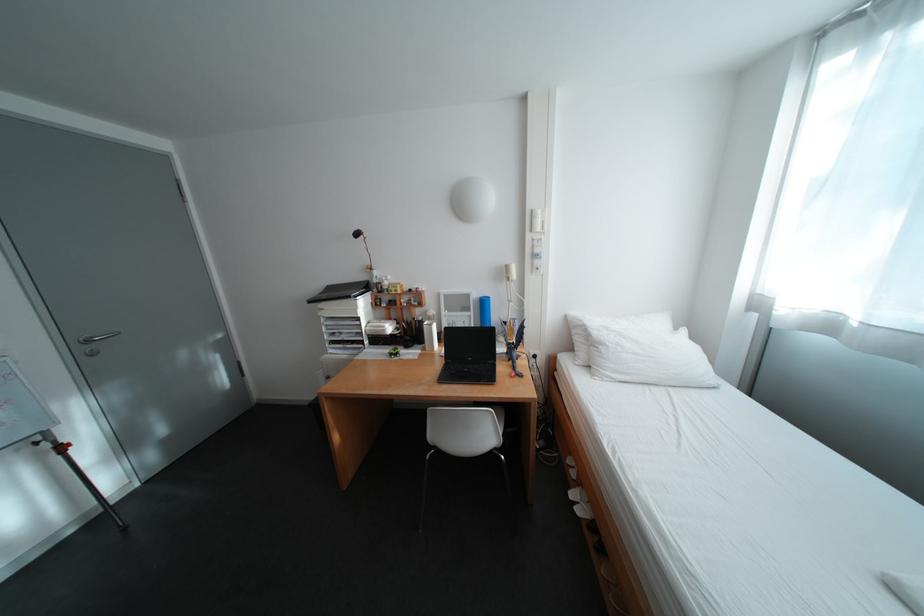
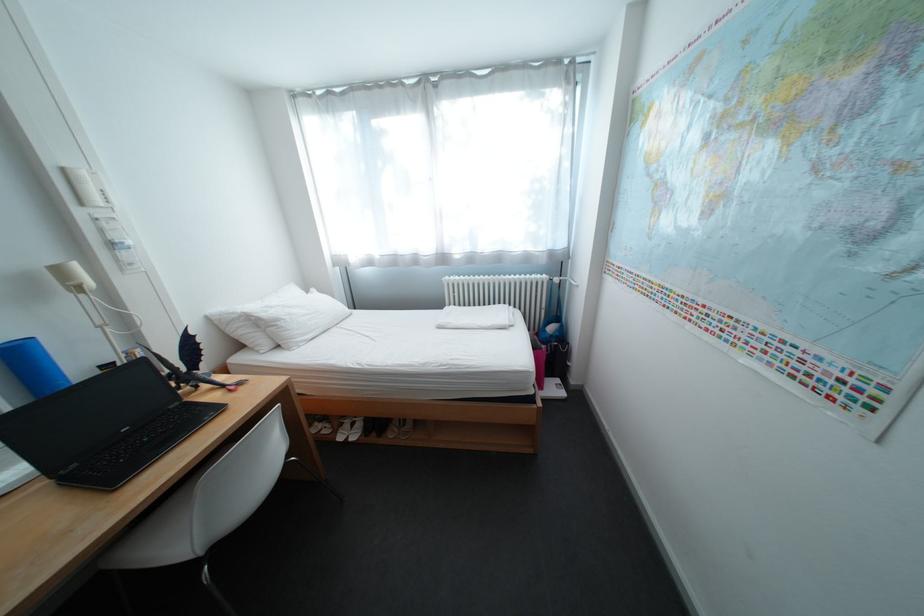
In the second image, find the point that corresponds to (614,346) in the first image.

(292, 322)